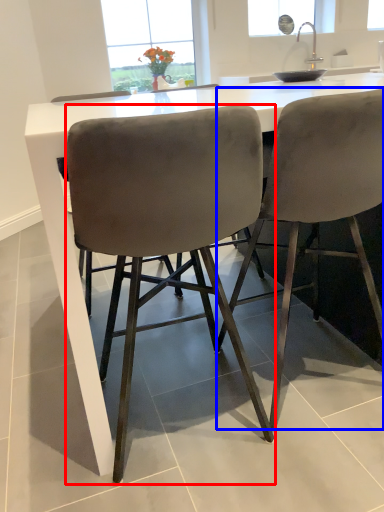
Question: Which point is further to the camera, chair (highlighted by a red box) or chair (highlighted by a blue box)?

Choices:
 (A) chair
 (B) chair

Answer: (B)